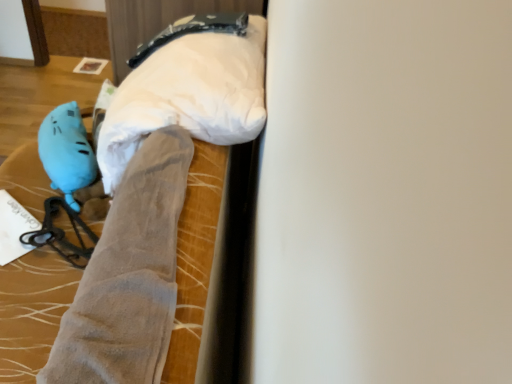
Locate an element on the screen. The width and height of the screenshot is (512, 384). suede-like gray legging at center-left is located at coordinates (129, 275).

Describe the element at coordinates (129, 275) in the screenshot. The width and height of the screenshot is (512, 384). I see `suede-like gray legging at center-left` at that location.

Image resolution: width=512 pixels, height=384 pixels. In order to click on white fabric pillow at upper center in this screenshot , I will do `click(188, 95)`.

This screenshot has width=512, height=384. Describe the element at coordinates (61, 233) in the screenshot. I see `blue rubber glove at lower left` at that location.

This screenshot has width=512, height=384. Identify the location of matte blue plush at left. (67, 151).

In the scene shown: Is the depth of velvet-like gray blanket at center less than that of matte blue plush at left?

Yes, velvet-like gray blanket at center is closer to the camera.

From the image's perspective, is velvet-like gray blanket at center on top of matte blue plush at left?

No, from the image's perspective, velvet-like gray blanket at center is not above matte blue plush at left.

Does velvet-like gray blanket at center appear on the right side of matte blue plush at left?

Yes.

Is velvet-like gray blanket at center taller than matte blue plush at left?

Yes.

Is the depth of blue rubber glove at lower left greater than that of suede-like gray legging at center-left?

Yes.

Can you tell me how much blue rubber glove at lower left and suede-like gray legging at center-left differ in facing direction?

The angle between the facing direction of blue rubber glove at lower left and the facing direction of suede-like gray legging at center-left is 43.1 degrees.

Considering the relative sizes of blue rubber glove at lower left and suede-like gray legging at center-left in the image provided, is blue rubber glove at lower left thinner than suede-like gray legging at center-left?

A: Yes.

Who is more distant, suede-like gray legging at center-left or white fabric pillow at upper center?

white fabric pillow at upper center is more distant.

Who is bigger, suede-like gray legging at center-left or white fabric pillow at upper center?

white fabric pillow at upper center is bigger.

Based on the photo, is white fabric pillow at upper center completely or partially inside suede-like gray legging at center-left?

No.

Considering the positions of points (66, 352) and (256, 80), is point (66, 352) farther from camera compared to point (256, 80)?

No, (66, 352) is closer to viewer.

In the image, is velvet-like gray blanket at center positioned in front of or behind white fabric pillow at upper center?

Clearly, velvet-like gray blanket at center is in front of white fabric pillow at upper center.

From the image's perspective, is velvet-like gray blanket at center located beneath white fabric pillow at upper center?

Indeed, from the image's perspective, velvet-like gray blanket at center is shown beneath white fabric pillow at upper center.

Is velvet-like gray blanket at center turned away from white fabric pillow at upper center?

Yes, velvet-like gray blanket at center is positioned with its back facing white fabric pillow at upper center.

Between suede-like gray legging at center-left and velvet-like gray blanket at center, which one is positioned in front?

velvet-like gray blanket at center.

From a real-world perspective, is suede-like gray legging at center-left positioned above or below velvet-like gray blanket at center?

Clearly, from a real-world perspective, suede-like gray legging at center-left is above velvet-like gray blanket at center.

Who is bigger, suede-like gray legging at center-left or velvet-like gray blanket at center?

velvet-like gray blanket at center is bigger.

Is white fabric pillow at upper center turned away from blue rubber glove at lower left?

That's not correct — white fabric pillow at upper center is not looking away from blue rubber glove at lower left.

Does white fabric pillow at upper center lie in front of blue rubber glove at lower left?

Yes, white fabric pillow at upper center is closer to the viewer.

Looking at this image, from a real-world perspective, is white fabric pillow at upper center physically located above or below blue rubber glove at lower left?

In terms of real-world spatial position, white fabric pillow at upper center is above blue rubber glove at lower left.

Would you say white fabric pillow at upper center is a long distance from blue rubber glove at lower left?

Actually, white fabric pillow at upper center and blue rubber glove at lower left are a little close together.

At what (x,y) coordinates should I click in order to perform the action: click on tight on the right of blue rubber glove at lower left. Please return your answer as a coordinate pair (x, y). Looking at the image, I should click on (129, 275).

From the image's perspective, which object appears higher, suede-like gray legging at center-left or blue rubber glove at lower left?

blue rubber glove at lower left appears higher in the image.

Can you tell me how much suede-like gray legging at center-left and blue rubber glove at lower left differ in facing direction?

suede-like gray legging at center-left and blue rubber glove at lower left are facing 43.1 degrees away from each other.

From a real-world perspective, is suede-like gray legging at center-left above or below blue rubber glove at lower left?

suede-like gray legging at center-left is above blue rubber glove at lower left.

At what (x,y) coordinates should I click in order to perform the action: click on toy that appears above the velvet-like gray blanket at center (from a real-world perspective). Please return your answer as a coordinate pair (x, y). The image size is (512, 384). Looking at the image, I should click on [67, 151].

Locate an element on the screen. The width and height of the screenshot is (512, 384). twin that is behind the suede-like gray legging at center-left is located at coordinates (61, 233).

When comparing their distances from velvet-like gray blanket at center, does blue rubber glove at lower left or matte blue plush at left seem closer?

blue rubber glove at lower left is positioned closer to the anchor velvet-like gray blanket at center.

Estimate the real-world distances between objects in this image. Which object is closer to blue rubber glove at lower left, matte blue plush at left or velvet-like gray blanket at center?

Based on the image, velvet-like gray blanket at center appears to be nearer to blue rubber glove at lower left.

Estimate the real-world distances between objects in this image. Which object is further from matte blue plush at left, velvet-like gray blanket at center or white fabric pillow at upper center?

white fabric pillow at upper center is further to matte blue plush at left.

In the scene shown: Considering their positions, is velvet-like gray blanket at center positioned closer to white fabric pillow at upper center than suede-like gray legging at center-left?

suede-like gray legging at center-left.

Estimate the real-world distances between objects in this image. Which object is closer to velvet-like gray blanket at center, suede-like gray legging at center-left or blue rubber glove at lower left?

The object closer to velvet-like gray blanket at center is blue rubber glove at lower left.

Which object lies further to the anchor point suede-like gray legging at center-left, white fabric pillow at upper center or blue rubber glove at lower left?

The object further to suede-like gray legging at center-left is blue rubber glove at lower left.

Looking at the image, which one is located closer to suede-like gray legging at center-left, matte blue plush at left or velvet-like gray blanket at center?

velvet-like gray blanket at center lies closer to suede-like gray legging at center-left than the other object.

From the image, which object appears to be farther from white fabric pillow at upper center, blue rubber glove at lower left or velvet-like gray blanket at center?

Result: The object further to white fabric pillow at upper center is velvet-like gray blanket at center.

Find the location of a particular element. Image resolution: width=512 pixels, height=384 pixels. wide between suede-like gray legging at center-left and blue rubber glove at lower left in the front-back direction is located at coordinates (188, 95).

Identify the location of wide between suede-like gray legging at center-left and matte blue plush at left in the front-back direction. The image size is (512, 384). (188, 95).

This screenshot has width=512, height=384. What are the coordinates of `tight located between velvet-like gray blanket at center and blue rubber glove at lower left in the depth direction` in the screenshot? It's located at (129, 275).

At what (x,y) coordinates should I click in order to perform the action: click on tight between velvet-like gray blanket at center and matte blue plush at left along the z-axis. Please return your answer as a coordinate pair (x, y). Looking at the image, I should click on (129, 275).